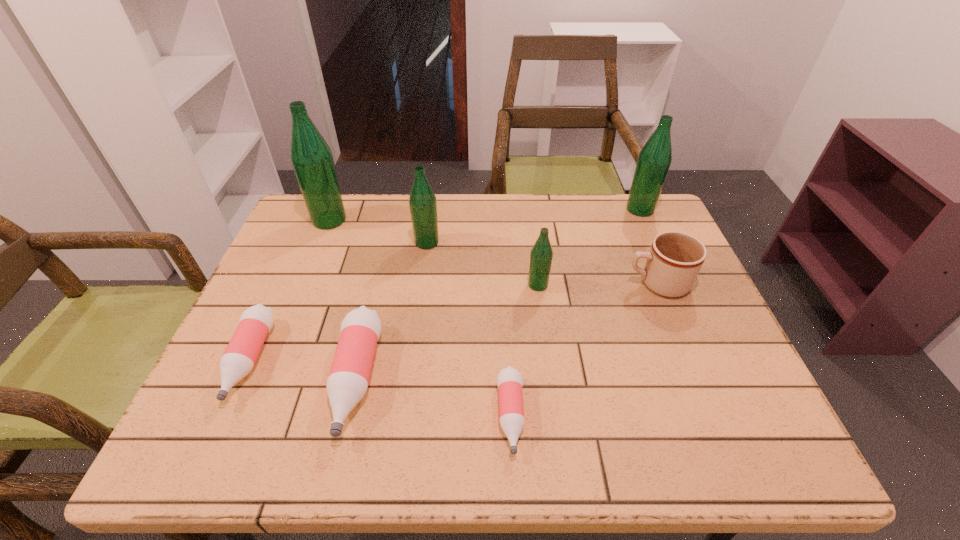
Where is `vacant area at the far right corner`? This screenshot has height=540, width=960. vacant area at the far right corner is located at coordinates tap(650, 218).

Where is `vacant point located between the third object from right to left and the second shortest object`? vacant point located between the third object from right to left and the second shortest object is located at coordinates (394, 322).

This screenshot has height=540, width=960. In order to click on vacant area between the third shortest bottle and the leftmost green bottle in this screenshot , I will do click(x=343, y=299).

This screenshot has width=960, height=540. Find the location of `free space that is in between the rightmost green bottle and the sixth object from right to left`. free space that is in between the rightmost green bottle and the sixth object from right to left is located at coordinates (498, 294).

Find the location of a particular element. free space between the biggest green bottle and the fifth shortest bottle is located at coordinates (378, 231).

Where is `free spot between the sixth object from left to right and the shortest bottle`? This screenshot has height=540, width=960. free spot between the sixth object from left to right and the shortest bottle is located at coordinates point(524,350).

This screenshot has height=540, width=960. Identify the location of vacant area between the sixth object from right to left and the fourth object from left to right. (392, 310).

Locate an element on the screen. This screenshot has width=960, height=540. unoccupied area between the mug and the biggest green bottle is located at coordinates (493, 252).

Image resolution: width=960 pixels, height=540 pixels. Identify the location of vacant region between the fifth tallest bottle and the rightmost bottle. (498, 294).

At what (x,y) coordinates should I click in order to perform the action: click on empty location between the rightmost bottle and the smallest pink bottle. Please return your answer as a coordinate pair (x, y). This screenshot has height=540, width=960. Looking at the image, I should click on (575, 313).